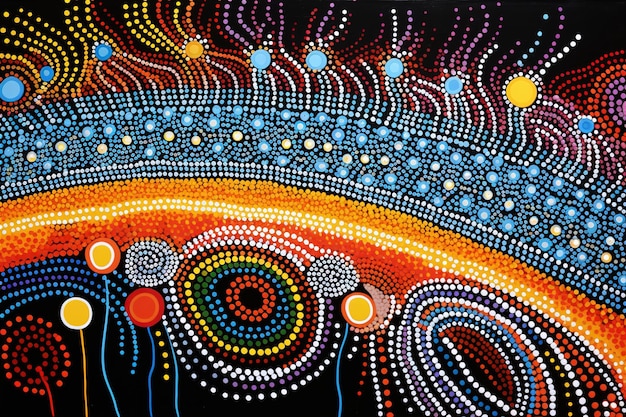
The image size is (626, 417). Find the location of `light design`. light design is located at coordinates (274, 307).